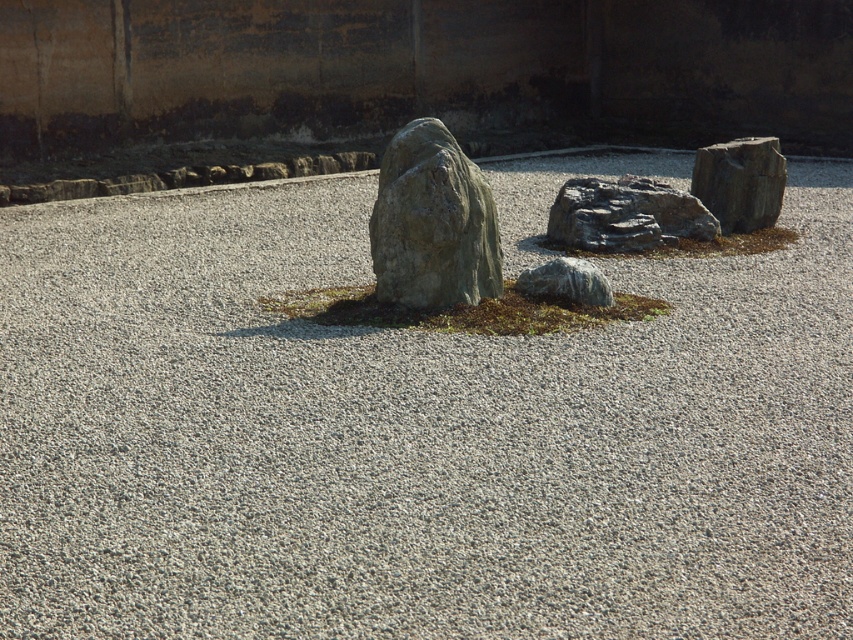
Question: Which of the following is the closest to the observer?

Choices:
 (A) (485, 225)
 (B) (636, 198)
 (C) (556, 291)
 (D) (749, 195)

Answer: (A)

Question: Can you confirm if gray rough stone at center is smaller than gray rough rock at center?

Choices:
 (A) yes
 (B) no

Answer: (B)

Question: Among these objects, which one is nearest to the camera?

Choices:
 (A) gray rough rock at center
 (B) smooth gray rock at right
 (C) rough gray rock at center
 (D) gray rough stone at center

Answer: (D)

Question: Can you confirm if rough gray rock at center is positioned below smooth gray rock at right?

Choices:
 (A) no
 (B) yes

Answer: (B)

Question: Which of the following is the closest to the observer?

Choices:
 (A) (635, 202)
 (B) (759, 186)
 (C) (569, 282)

Answer: (C)

Question: Does rough gray rock at center appear on the right side of smooth gray rock at right?

Choices:
 (A) yes
 (B) no

Answer: (B)